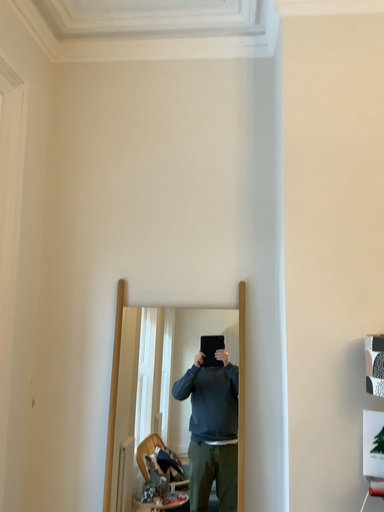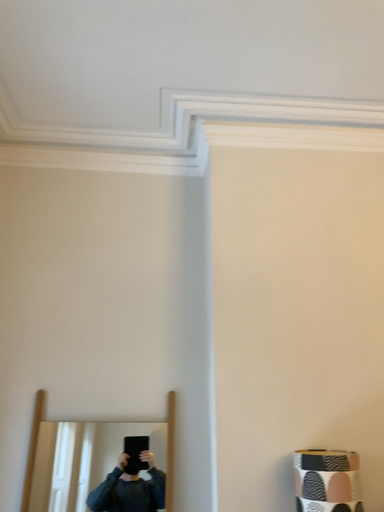
Question: How did the camera likely rotate when shooting the video?

Choices:
 (A) rotated downward
 (B) rotated upward

Answer: (B)